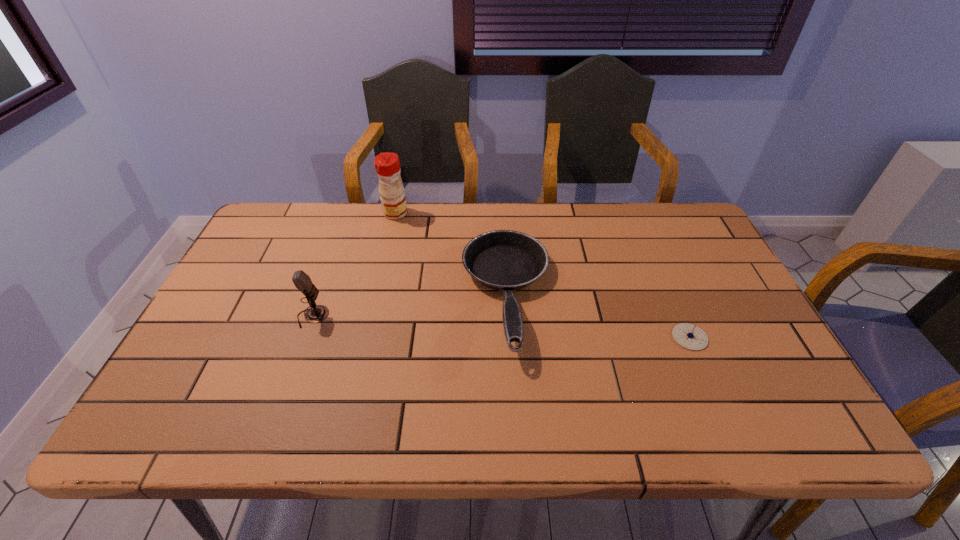
This screenshot has width=960, height=540. I want to click on free space located 0.050m on the back of the frying pan, so [x=503, y=231].

At what (x,y) coordinates should I click in order to perform the action: click on vacant space located 0.130m on the front of the compass. Please return your answer as a coordinate pair (x, y). Looking at the image, I should click on (716, 399).

This screenshot has height=540, width=960. I want to click on condiment that is positioned at the far edge, so click(387, 165).

Locate an element on the screen. The height and width of the screenshot is (540, 960). frying pan that is positioned at the far edge is located at coordinates (505, 260).

Identify the location of object located at the right edge. (689, 336).

Locate an element on the screen. Image resolution: width=960 pixels, height=540 pixels. vacant space at the far edge of the desktop is located at coordinates (636, 217).

Where is `free region at the near edge of the desktop`? This screenshot has width=960, height=540. free region at the near edge of the desktop is located at coordinates (672, 427).

The height and width of the screenshot is (540, 960). Identify the location of vacant space at the left edge of the desktop. (265, 318).

Identify the location of free point at the near left corner. (147, 417).

This screenshot has width=960, height=540. I want to click on vacant space at the far right corner of the desktop, so click(x=699, y=240).